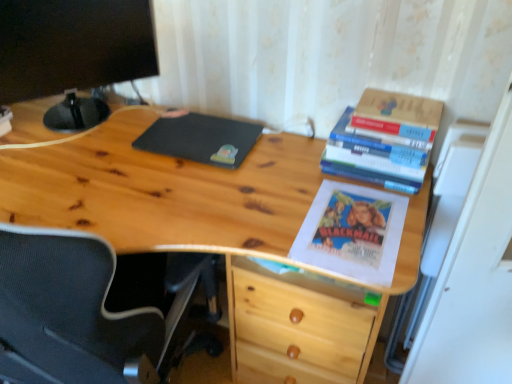
Locate an element on the screen. The width and height of the screenshot is (512, 384). free region on the left part of black matte mousepad at center is located at coordinates (111, 144).